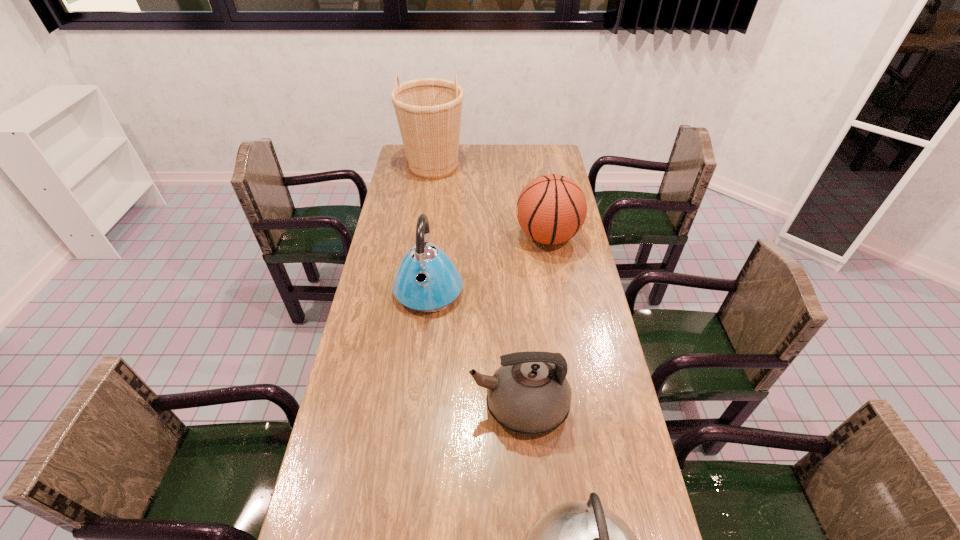
I want to click on the closest object to the tallest object, so click(x=551, y=209).

Select which object is the third closest to the tallest object. Please provide its 2D coordinates. Your answer should be formatted as a tuple, i.e. [(x, y)], where the tuple contains the x and y coordinates of a point satisfying the conditions above.

[(529, 394)]

Where is `kettle that stands as the closest to the second farthest kettle`? The height and width of the screenshot is (540, 960). kettle that stands as the closest to the second farthest kettle is located at coordinates (579, 539).

This screenshot has height=540, width=960. What are the coordinates of `kettle that is the second closest to the second farthest kettle` in the screenshot? It's located at pos(427,280).